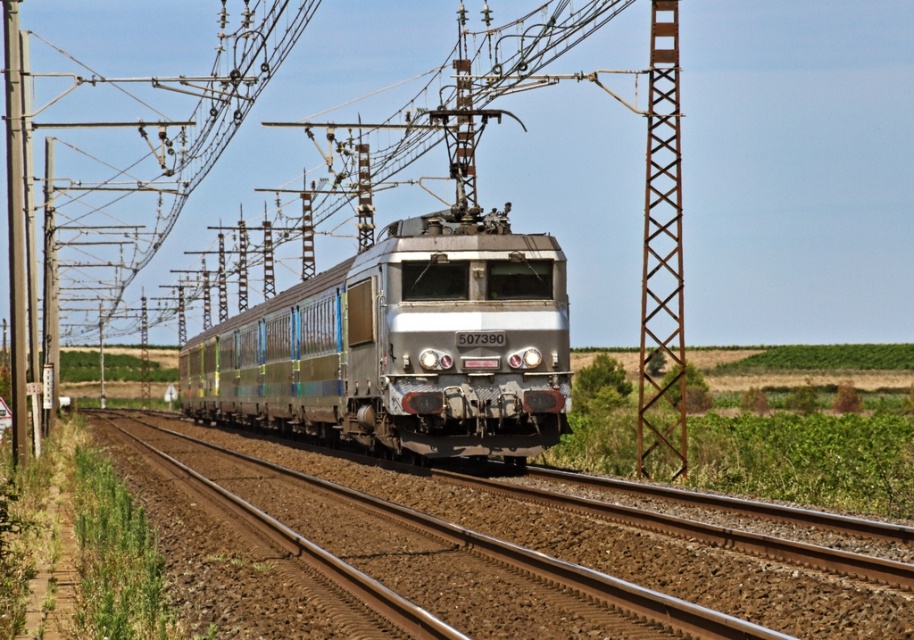
Can you confirm if silver metallic train at center is positioned to the left of rusty metal tower at center-right?

Yes, silver metallic train at center is to the left of rusty metal tower at center-right.

Is point (489, 400) positioned after point (664, 413)?

No, it is not.

Who is more forward, (442,353) or (661,65)?

Positioned in front is point (442,353).

Identify the location of silver metallic train at center. (402, 346).